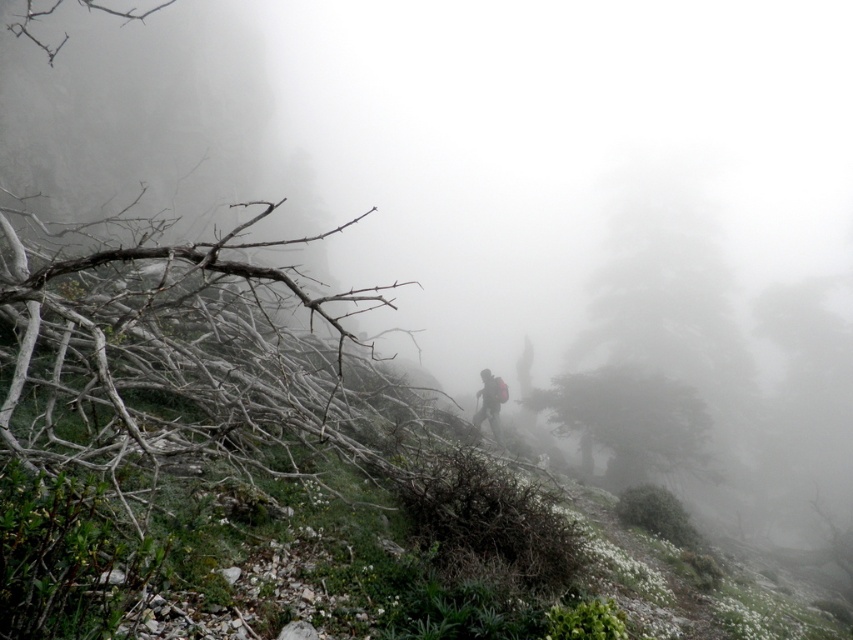
Is green matte tree at center taller than dark gray fabric backpack at center?

Yes.

Does green matte tree at center have a lesser height compared to dark gray fabric backpack at center?

No.

Which is behind, point (572, 392) or point (489, 376)?

The point (572, 392) is behind.

You are a GUI agent. You are given a task and a screenshot of the screen. Output one action in this format:
    pyautogui.click(x=<x>, y=<y>)
    Task: Click on the green matte tree at center
    
    Given the screenshot: What is the action you would take?
    pyautogui.click(x=630, y=420)

Which is in front, point (614, 460) or point (596, 442)?

Positioned in front is point (596, 442).

Is dark green textured tree at center closer to camera compared to green matte tree at center?

No, it is behind green matte tree at center.

Where is `dark green textured tree at center`? This screenshot has height=640, width=853. dark green textured tree at center is located at coordinates (659, 349).

Does dark green textured tree at center appear over dark gray fabric backpack at center?

Indeed, dark green textured tree at center is positioned over dark gray fabric backpack at center.

Locate an element on the screen. Image resolution: width=853 pixels, height=640 pixels. dark green textured tree at center is located at coordinates (659, 349).

Does point (590, 376) come in front of point (486, 385)?

That is False.

Find the location of a particular element. The image size is (853, 640). dark green textured tree at center is located at coordinates (659, 349).